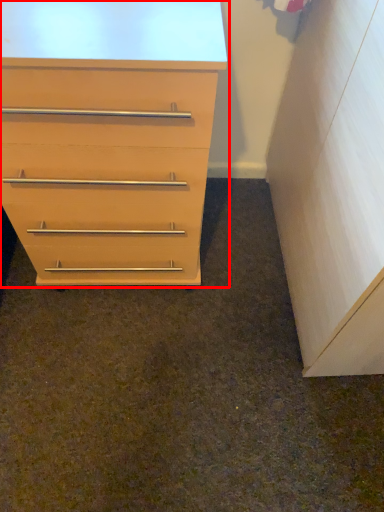
Question: From the image's perspective, what is the correct spatial relationship of chest of drawers (annotated by the red box) in relation to file cabinet?

Choices:
 (A) above
 (B) below

Answer: (A)